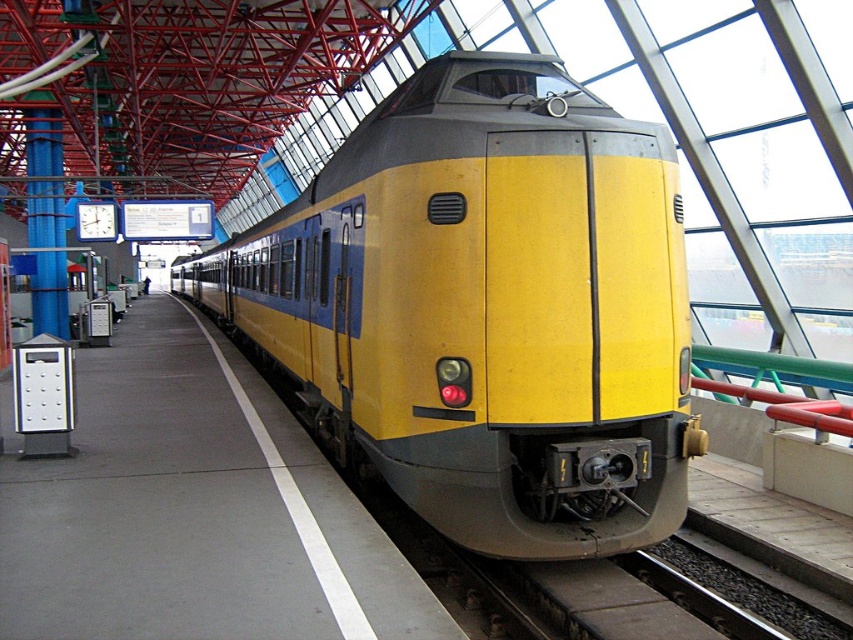
Question: Is yellow matte train at center above yellow matte platform at center?

Choices:
 (A) no
 (B) yes

Answer: (B)

Question: Is yellow matte train at center below yellow matte platform at center?

Choices:
 (A) no
 (B) yes

Answer: (A)

Question: Which of the following is the farthest from the observer?

Choices:
 (A) yellow matte train at center
 (B) yellow matte platform at center

Answer: (A)

Question: Which point is farther to the camera?

Choices:
 (A) (370, 605)
 (B) (393, 312)

Answer: (B)

Question: Does yellow matte train at center lie in front of yellow matte platform at center?

Choices:
 (A) yes
 (B) no

Answer: (B)